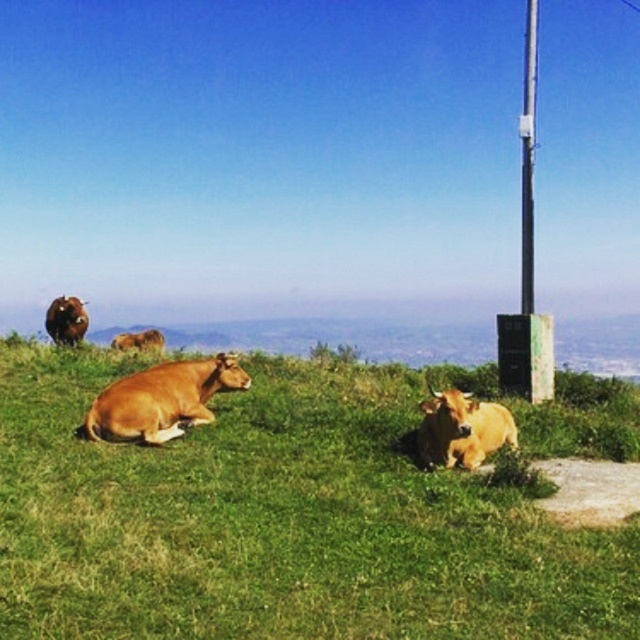
Question: Considering the real-world distances, which object is farthest from the brown smooth cow at upper left?

Choices:
 (A) green grass at center
 (B) brown smooth cow at lower left
 (C) metallic pole at right
 (D) brown furry bull at lower left

Answer: (C)

Question: Does brown glossy cow at lower right have a smaller size compared to metallic pole at right?

Choices:
 (A) no
 (B) yes

Answer: (B)

Question: Is green grass at center bigger than brown glossy cow at lower right?

Choices:
 (A) no
 (B) yes

Answer: (B)

Question: Is brown smooth cow at lower left smaller than metallic pole at right?

Choices:
 (A) no
 (B) yes

Answer: (B)

Question: Which of these objects is positioned farthest from the brown smooth cow at lower left?

Choices:
 (A) brown smooth cow at upper left
 (B) green grass at center
 (C) brown furry bull at lower left

Answer: (C)

Question: Which point is closer to the camera?

Choices:
 (A) brown glossy cow at lower right
 (B) brown smooth cow at upper left
 (C) brown smooth cow at lower left

Answer: (A)